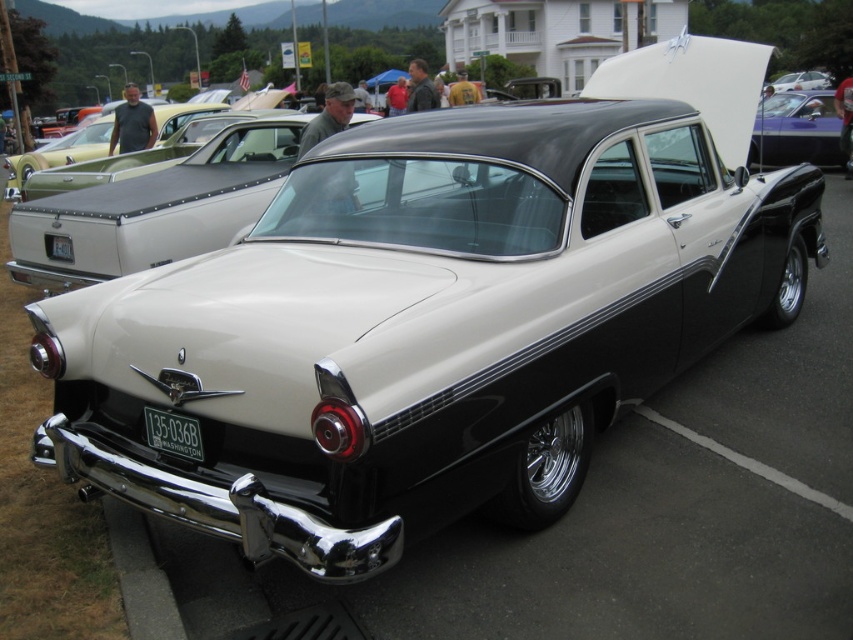
Question: Considering the real-world distances, which object is farthest from the purple glossy car at upper right?

Choices:
 (A) green metallic license plate at rear
 (B) black metallic license plate at lower center

Answer: (A)

Question: Does purple glossy car at upper right appear over green metallic license plate at rear?

Choices:
 (A) no
 (B) yes

Answer: (B)

Question: Based on their relative distances, which object is farther from the green metallic license plate at rear?

Choices:
 (A) purple glossy car at upper right
 (B) black metallic license plate at lower center

Answer: (A)

Question: Estimate the real-world distances between objects in this image. Which object is farther from the black metallic license plate at lower center?

Choices:
 (A) green metallic license plate at rear
 (B) purple glossy car at upper right

Answer: (B)

Question: Is purple glossy car at upper right bigger than black metallic license plate at lower center?

Choices:
 (A) yes
 (B) no

Answer: (A)

Question: Is black metallic license plate at lower center smaller than green metallic license plate at rear?

Choices:
 (A) yes
 (B) no

Answer: (A)